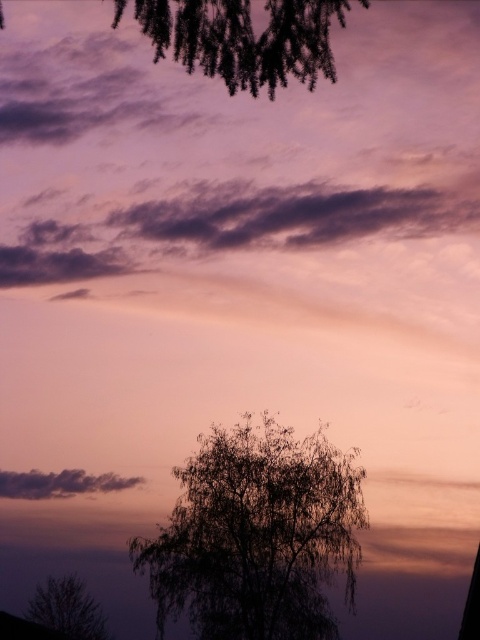
Between dark green textured leaves at upper center and dark gray cloud at upper left, which one appears on the right side from the viewer's perspective?

Positioned to the right is dark green textured leaves at upper center.

Identify the location of dark green textured leaves at upper center. The width and height of the screenshot is (480, 640). (245, 38).

The width and height of the screenshot is (480, 640). I want to click on dark green textured leaves at upper center, so click(x=245, y=38).

Can you confirm if dark purple cloud at upper center is positioned to the right of silvery metallic tree at lower left?

Indeed, dark purple cloud at upper center is positioned on the right side of silvery metallic tree at lower left.

This screenshot has width=480, height=640. What do you see at coordinates (229, 227) in the screenshot? I see `dark purple cloud at upper center` at bounding box center [229, 227].

Is point (154, 234) positioned in front of point (68, 621)?

No, it is behind (68, 621).

You are a GUI agent. You are given a task and a screenshot of the screen. Output one action in this format:
    pyautogui.click(x=<x>, y=<y>)
    Task: Click on the dark purple cloud at upper center
    The image size is (480, 640).
    Given the screenshot: What is the action you would take?
    pyautogui.click(x=229, y=227)

Can you confirm if silvery branches at center is bigger than silvery metallic tree at lower left?

Actually, silvery branches at center might be smaller than silvery metallic tree at lower left.

Who is positioned more to the left, silvery branches at center or silvery metallic tree at lower left?

Positioned to the left is silvery metallic tree at lower left.

Between point (192, 477) and point (29, 600), which one is positioned behind?

The point (29, 600) is more distant.

At what (x,y) coordinates should I click in order to perform the action: click on silvery branches at center. Please return your answer as a coordinate pair (x, y). This screenshot has height=640, width=480. Looking at the image, I should click on (256, 536).